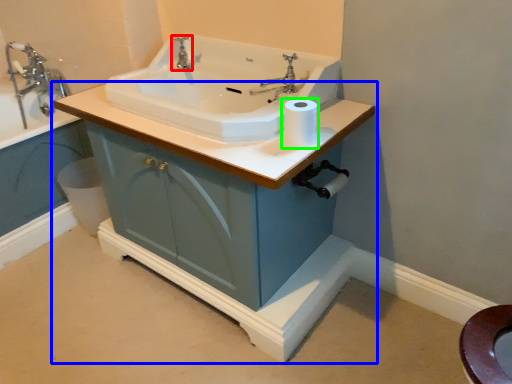
Question: Which is nearer to the tap (highlighted by a red box)? bathroom cabinet (highlighted by a blue box) or toilet paper (highlighted by a green box).

Choices:
 (A) bathroom cabinet
 (B) toilet paper

Answer: (B)